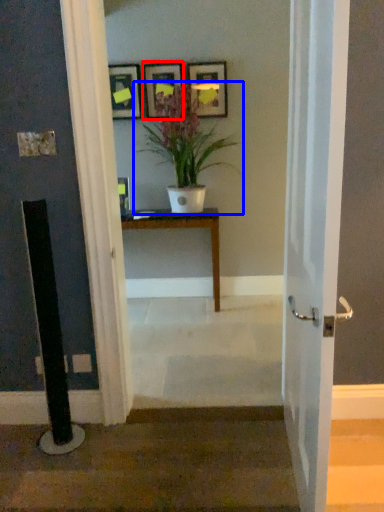
Question: Which of the following is the closest to the observer, picture frame (highlighted by a red box) or houseplant (highlighted by a blue box)?

Choices:
 (A) picture frame
 (B) houseplant

Answer: (B)